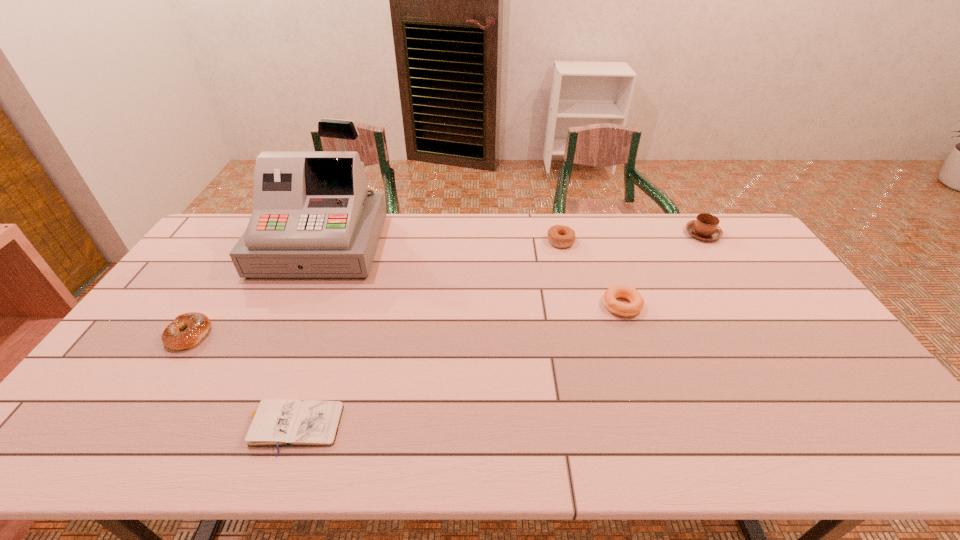
Locate an element on the screen. This screenshot has width=960, height=540. object at the right edge is located at coordinates (705, 227).

Where is `object present at the far right corner`? The width and height of the screenshot is (960, 540). object present at the far right corner is located at coordinates tap(705, 227).

Locate an element on the screen. The image size is (960, 540). blank space at the far edge of the desktop is located at coordinates (586, 246).

Locate an element on the screen. The width and height of the screenshot is (960, 540). vacant space at the near edge of the desktop is located at coordinates (571, 433).

What are the coordinates of `vacant space at the left edge of the desktop` in the screenshot? It's located at (165, 367).

Where is `free space at the right edge of the desktop`? The width and height of the screenshot is (960, 540). free space at the right edge of the desktop is located at coordinates (786, 343).

Find the location of a particular element. This screenshot has height=540, width=960. vacant space at the far right corner of the desktop is located at coordinates (722, 248).

Where is `empty space that is in between the leftmost bagel and the farthest bagel`? empty space that is in between the leftmost bagel and the farthest bagel is located at coordinates (375, 288).

Where is `vacant area between the leftmost bagel and the nearest object`? Image resolution: width=960 pixels, height=540 pixels. vacant area between the leftmost bagel and the nearest object is located at coordinates (240, 380).

You are a GUI agent. You are given a task and a screenshot of the screen. Output one action in this format:
    pyautogui.click(x=<x>, y=<y>)
    Task: Click on the vacant point located between the second object from right to left and the cappuccino
    
    Given the screenshot: What is the action you would take?
    click(x=662, y=269)